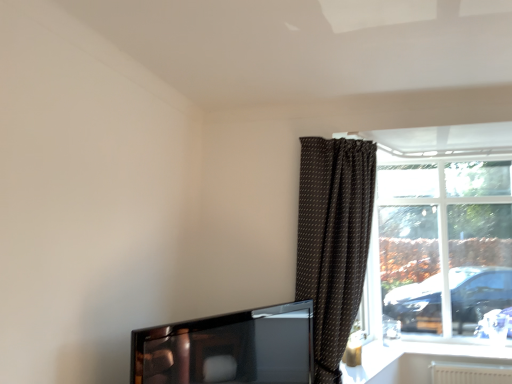
Question: Is brown dotted fabric curtain at right to the right of shiny black tv at lower left from the viewer's perspective?

Choices:
 (A) no
 (B) yes

Answer: (B)

Question: Does brown dotted fabric curtain at right have a lesser height compared to shiny black tv at lower left?

Choices:
 (A) yes
 (B) no

Answer: (B)

Question: Is brown dotted fabric curtain at right facing away from shiny black tv at lower left?

Choices:
 (A) no
 (B) yes

Answer: (A)

Question: Does brown dotted fabric curtain at right turn towards shiny black tv at lower left?

Choices:
 (A) no
 (B) yes

Answer: (A)

Question: Is brown dotted fabric curtain at right wider than shiny black tv at lower left?

Choices:
 (A) yes
 (B) no

Answer: (A)

Question: From the image's perspective, is brown dotted fabric curtain at right over shiny black tv at lower left?

Choices:
 (A) no
 (B) yes

Answer: (B)

Question: From a real-world perspective, is transparent glass window at right positioned under brown dotted fabric curtain at right based on gravity?

Choices:
 (A) yes
 (B) no

Answer: (B)

Question: Would you say brown dotted fabric curtain at right is part of transparent glass window at right's contents?

Choices:
 (A) no
 (B) yes

Answer: (A)

Question: Can you confirm if transparent glass window at right is shorter than brown dotted fabric curtain at right?

Choices:
 (A) yes
 (B) no

Answer: (A)

Question: Does transparent glass window at right have a greater width compared to brown dotted fabric curtain at right?

Choices:
 (A) yes
 (B) no

Answer: (B)

Question: From a real-world perspective, is transparent glass window at right positioned over brown dotted fabric curtain at right based on gravity?

Choices:
 (A) yes
 (B) no

Answer: (A)

Question: From the image's perspective, is transparent glass window at right on brown dotted fabric curtain at right?

Choices:
 (A) no
 (B) yes

Answer: (A)

Question: From the image's perspective, does brown dotted fabric curtain at right appear lower than transparent glass window at right?

Choices:
 (A) yes
 (B) no

Answer: (B)